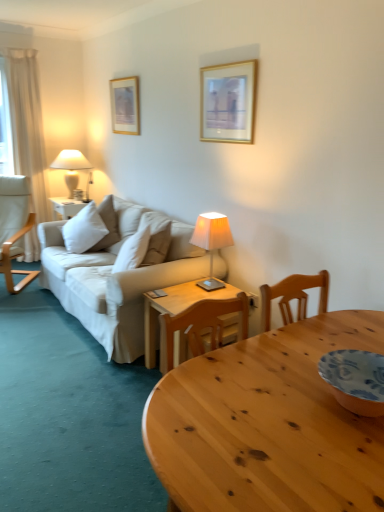
Question: From the image's perspective, is ivory fabric lampshade at center, which ranks as the second lamp in top-to-bottom order, above or below gold-framed picture at upper left, which ranks as the first picture frame in back-to-front order?

Choices:
 (A) above
 (B) below

Answer: (B)

Question: In terms of width, does ivory fabric lampshade at center, arranged as the second lamp when viewed from the back, look wider or thinner when compared to gold-framed picture at upper left, which is counted as the second picture frame, starting from the front?

Choices:
 (A) thin
 (B) wide

Answer: (B)

Question: Considering the real-world distances, which object is closest to the gold-framed picture at upper left, which appears as the 2th picture frame when viewed from the right?

Choices:
 (A) white soft cushion at center
 (B) white fabric lampshade at left, which is the 2th lamp in right-to-left order
 (C) white fabric chair at left, the 2th chair from the right
 (D) ivory fabric lampshade at center, which ranks as the second lamp in top-to-bottom order
 (E) gold-framed picture at upper center, which is the 2th picture frame from left to right

Answer: (B)

Question: Estimate the real-world distances between objects in this image. Which object is farther from the white fabric chair at left, the first chair when ordered from left to right?

Choices:
 (A) ivory fabric lampshade at center, positioned as the first lamp in right-to-left order
 (B) wooden chair at center, the 1th chair when ordered from bottom to top
 (C) gold-framed picture at upper center, which is the 1th picture frame in right-to-left order
 (D) white fabric lampshade at left, which is the 2th lamp in right-to-left order
 (E) white soft cushion at center

Answer: (B)